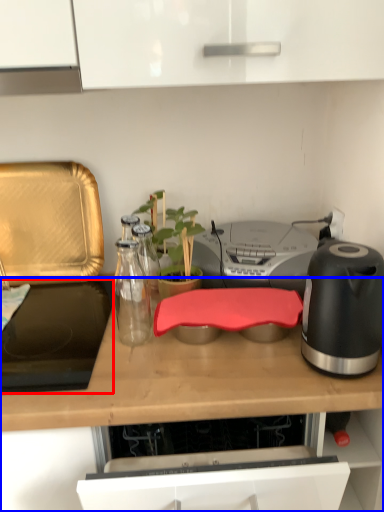
Question: Which of the following is the closest to the observer, gas stove (highlighted by a red box) or countertop (highlighted by a blue box)?

Choices:
 (A) gas stove
 (B) countertop

Answer: (B)